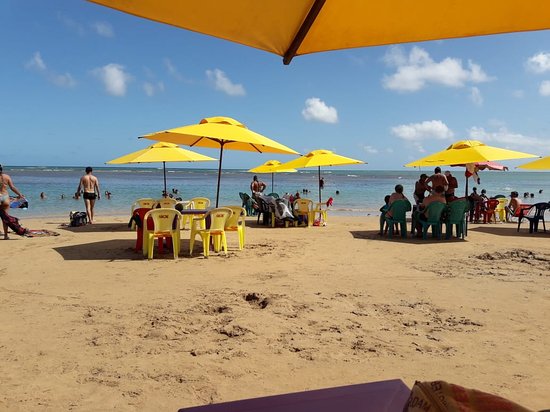
Where is `towel`? The height and width of the screenshot is (412, 550). towel is located at coordinates (283, 209), (139, 208).